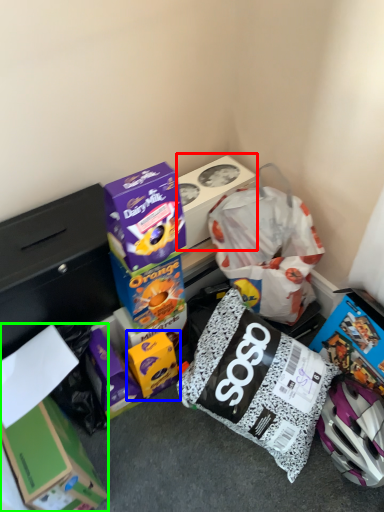
Question: Which object is the farthest from box (highlighted by a red box)? Choose among these: box (highlighted by a blue box) or box (highlighted by a green box).

Choices:
 (A) box
 (B) box

Answer: (B)